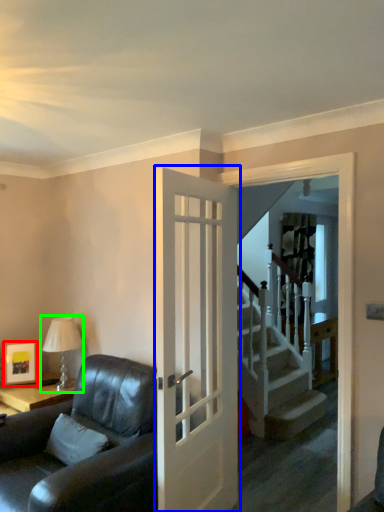
Question: Which object is positioned closest to picture frame (highlighted by a red box)? Select from door (highlighted by a blue box) and table lamp (highlighted by a green box).

Choices:
 (A) door
 (B) table lamp

Answer: (B)